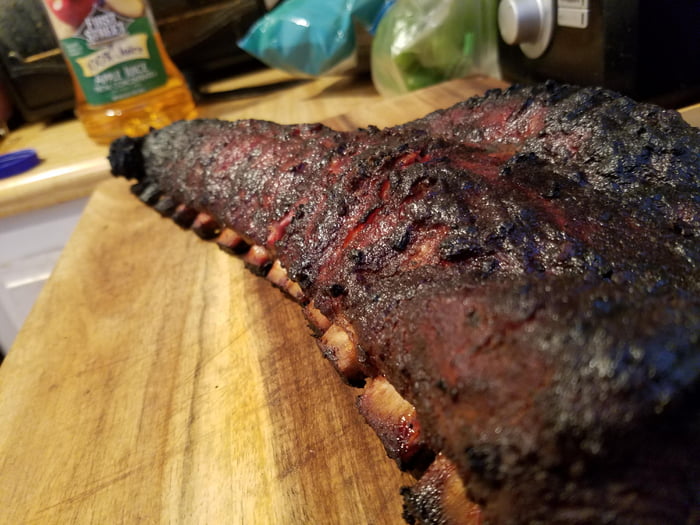
Where is `kitchen surface`? The width and height of the screenshot is (700, 525). kitchen surface is located at coordinates (73, 146), (90, 258).